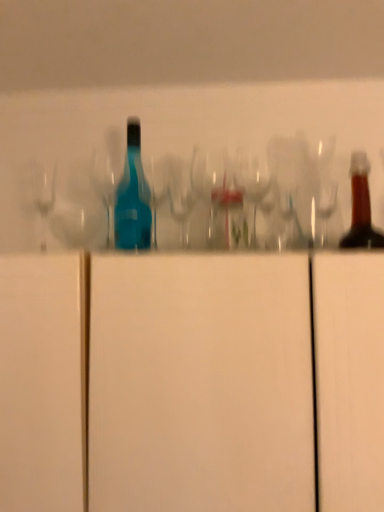
Question: Would you say clear glass wine glass at center is to the left or to the right of white matte cabinet at center in the picture?

Choices:
 (A) left
 (B) right

Answer: (B)

Question: From a real-world perspective, relative to white matte cabinet at center, is clear glass wine glass at center vertically above or below?

Choices:
 (A) above
 (B) below

Answer: (A)

Question: Which object is positioned farthest from the transparent glass shot glass at center?

Choices:
 (A) clear glass wine glass at center
 (B) white matte cabinet at center

Answer: (B)

Question: Considering the real-world distances, which object is farthest from the white matte cabinet at center?

Choices:
 (A) clear glass wine glass at center
 (B) transparent glass shot glass at center

Answer: (B)